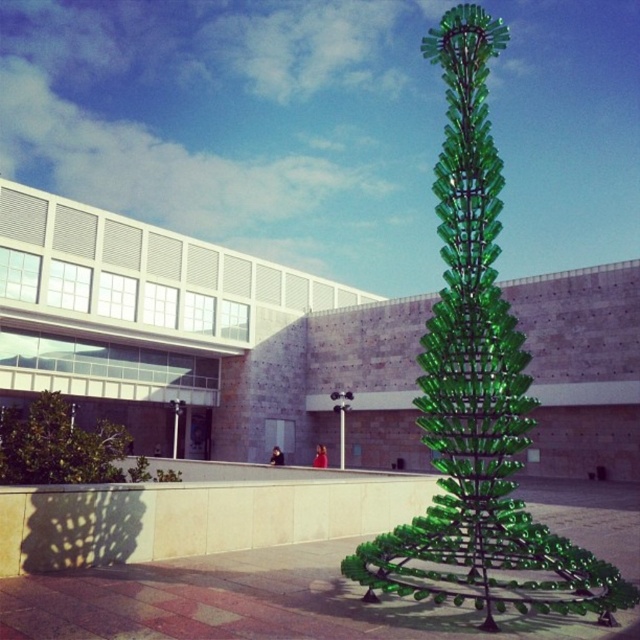
Question: Which object appears farthest from the camera in this image?

Choices:
 (A) green glass sculpture at center
 (B) green glass tree at lower left

Answer: (B)

Question: Can you confirm if green glass sculpture at center is positioned below green glass tree at lower left?

Choices:
 (A) yes
 (B) no

Answer: (B)

Question: Can you confirm if green glass sculpture at center is positioned to the left of green glass tree at lower left?

Choices:
 (A) yes
 (B) no

Answer: (B)

Question: Does green glass sculpture at center have a larger size compared to green glass tree at lower left?

Choices:
 (A) yes
 (B) no

Answer: (A)